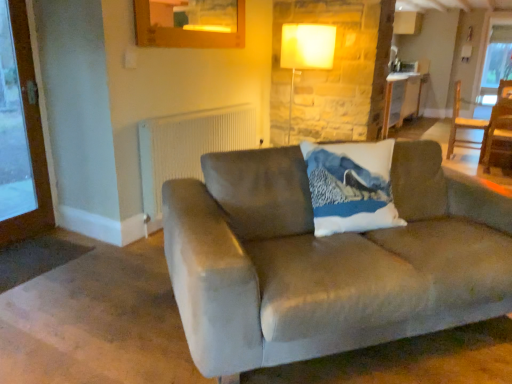
Where is `free space underneath wooden screen door at left (from a real-world perspective)`? free space underneath wooden screen door at left (from a real-world perspective) is located at coordinates (31, 231).